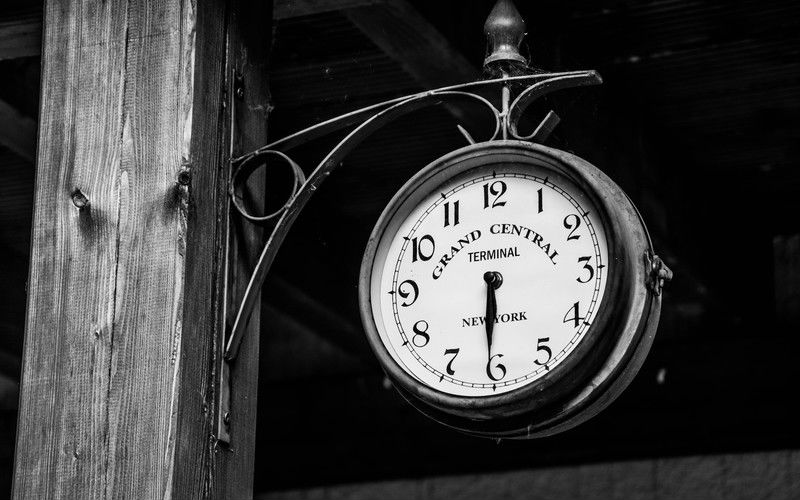
You are a GUI agent. You are given a task and a screenshot of the screen. Output one action in this format:
    pyautogui.click(x=<x>, y=<y>)
    Task: Click on the space below clock
    The image size is (800, 500).
    Given the screenshot: What is the action you would take?
    pyautogui.click(x=502, y=449)